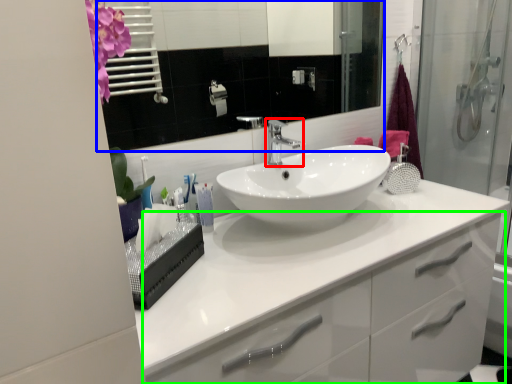
Question: Estimate the real-world distances between objects in this image. Which object is closer to tap (highlighted by a red box), mirror (highlighted by a blue box) or bathroom cabinet (highlighted by a green box)?

Choices:
 (A) mirror
 (B) bathroom cabinet

Answer: (B)